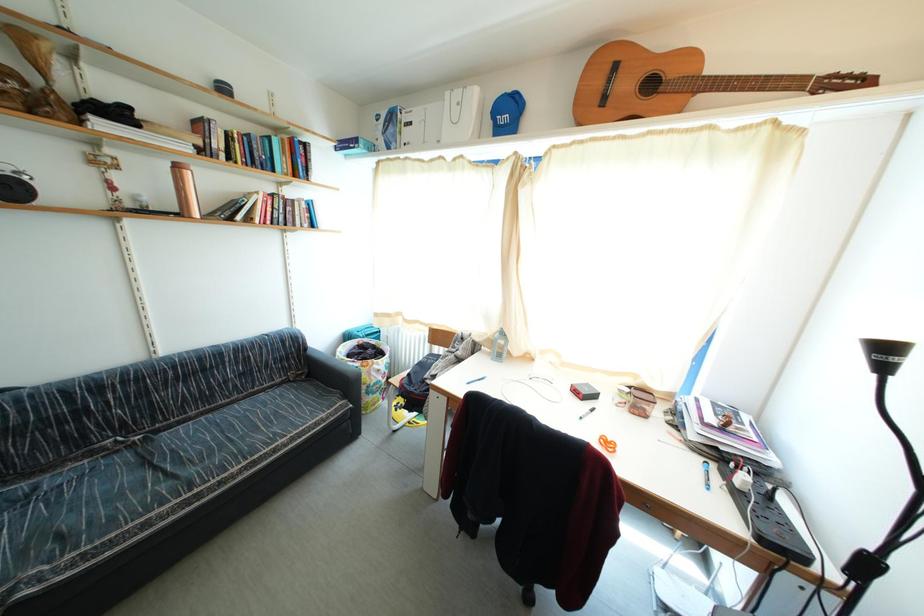
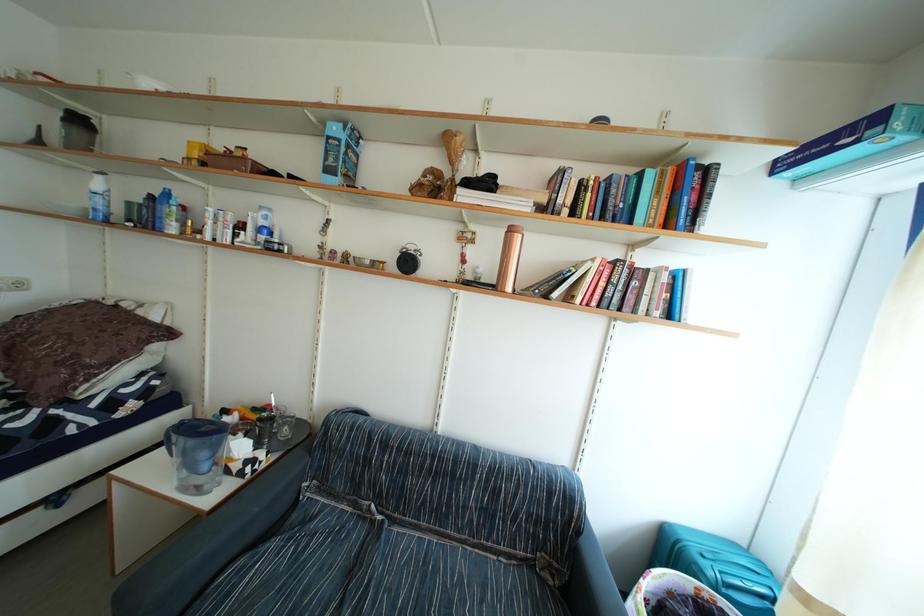
Question: The camera is either moving clockwise (left) or counter-clockwise (right) around the object. The first image is from the beginning of the video and the second image is from the end. Is the camera moving left or right when shooting the video?

Choices:
 (A) Left
 (B) Right

Answer: (B)